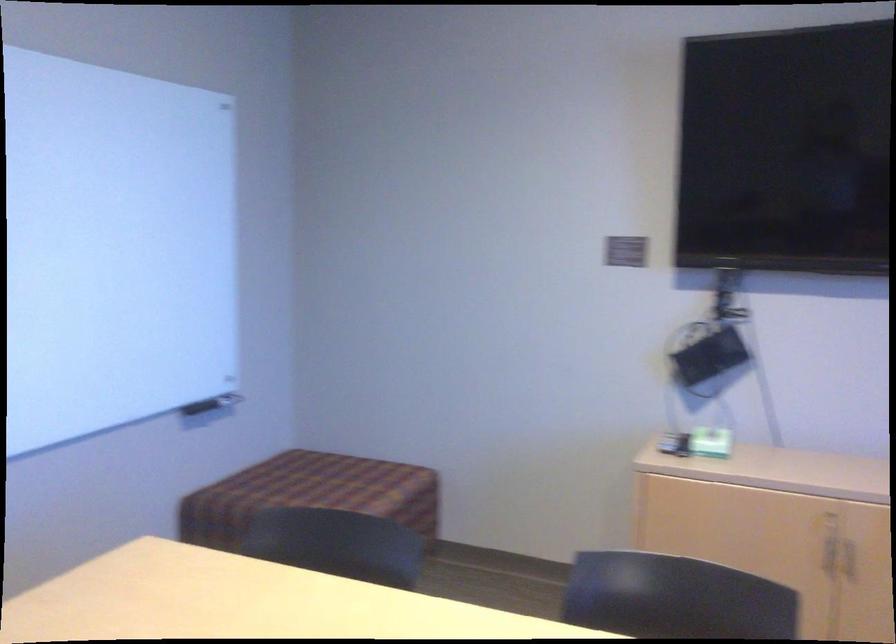
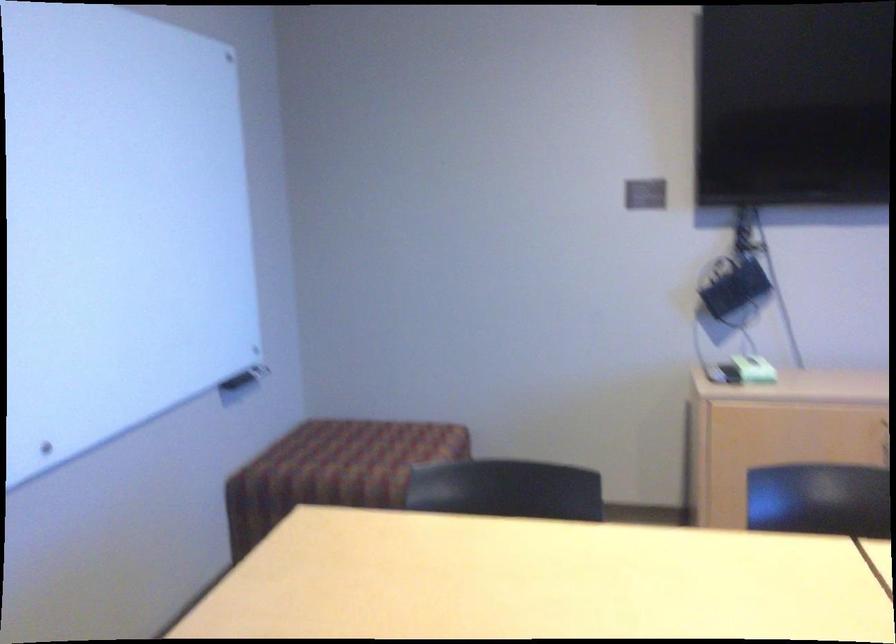
Where in the second image is the point corresponding to (x=213, y=399) from the first image?

(246, 373)